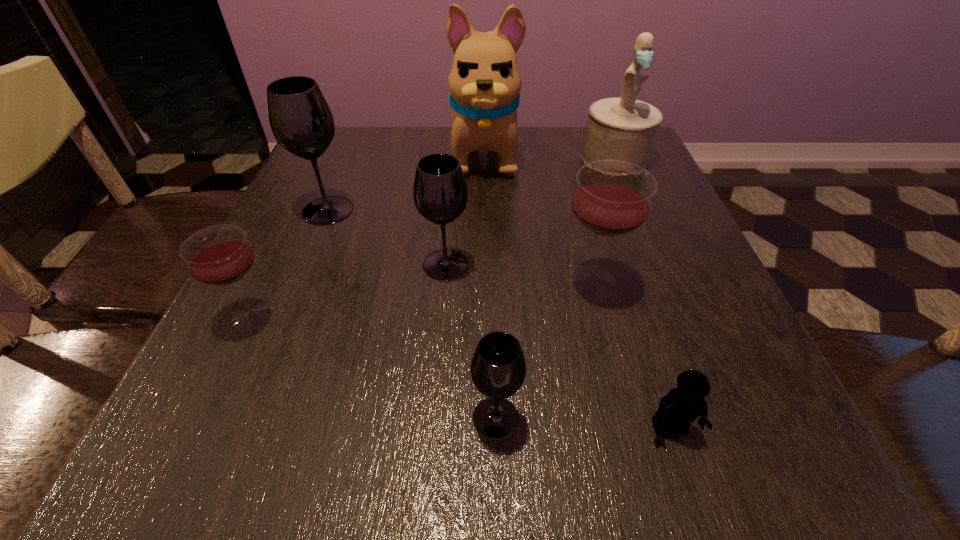
Locate an element on the screen. the second wineglass from right to left is located at coordinates (498, 368).

You are a GUI agent. You are given a task and a screenshot of the screen. Output one action in this format:
    pyautogui.click(x=<x>, y=<y>)
    Task: Click on the nearest wineglass
    This screenshot has width=960, height=540.
    Given the screenshot: What is the action you would take?
    pyautogui.click(x=498, y=368)

Locate an element on the screen. The height and width of the screenshot is (540, 960). Lego is located at coordinates [x=681, y=406].

Locate an element on the screen. yellow Lego is located at coordinates (681, 406).

Find the location of a particular element. vacant area located 0.050m on the face of the puppy is located at coordinates (486, 200).

Locate an element on the screen. Image resolution: width=960 pixels, height=540 pixels. blank area located at the beak of the white figurine is located at coordinates (636, 211).

Where is `free region located 0.210m on the front of the tallest wineglass`? The height and width of the screenshot is (540, 960). free region located 0.210m on the front of the tallest wineglass is located at coordinates (289, 307).

Locate an element on the screen. Image resolution: width=960 pixels, height=540 pixels. free space located 0.220m on the left of the rightmost wineglass is located at coordinates (430, 282).

You are a GUI agent. You are given a task and a screenshot of the screen. Output one action in this format:
    pyautogui.click(x=<x>, y=<y>)
    Task: Click on the vacant space located on the back of the second nearest gray wineglass
    
    Given the screenshot: What is the action you would take?
    pyautogui.click(x=449, y=217)

Find the location of a particular element. This screenshot has width=960, height=540. free space located on the front of the smaller red wineglass is located at coordinates (187, 454).